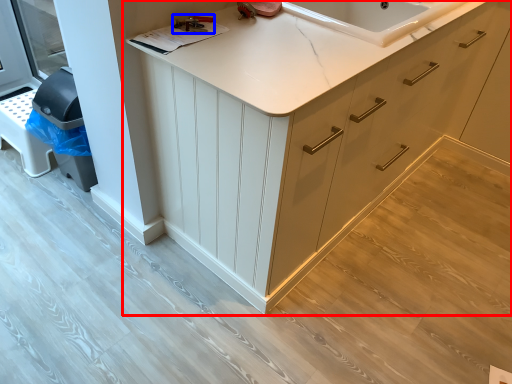
Question: Which of the following is the closest to the observer, cabinetry (highlighted by a red box) or tool (highlighted by a blue box)?

Choices:
 (A) cabinetry
 (B) tool

Answer: (A)